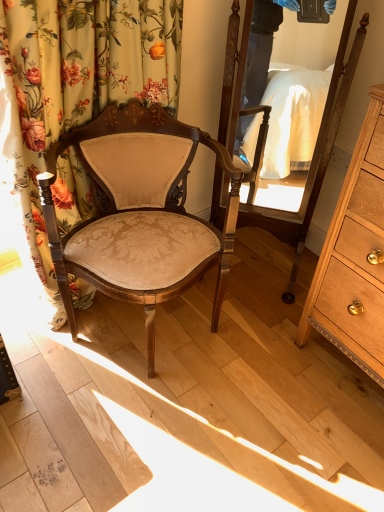
Question: Is light brown wood dresser at right in front of or behind floral fabric curtain at left in the image?

Choices:
 (A) front
 (B) behind

Answer: (A)

Question: From the image's perspective, is light brown wood dresser at right positioned above or below floral fabric curtain at left?

Choices:
 (A) above
 (B) below

Answer: (B)

Question: Considering the real-world distances, which object is closest to the matte beige fabric chair at center?

Choices:
 (A) light brown wood dresser at right
 (B) wooden mirror at center
 (C) floral fabric curtain at left

Answer: (C)

Question: Which object is positioned closest to the floral fabric curtain at left?

Choices:
 (A) matte beige fabric chair at center
 (B) wooden mirror at center
 (C) light brown wood dresser at right

Answer: (A)